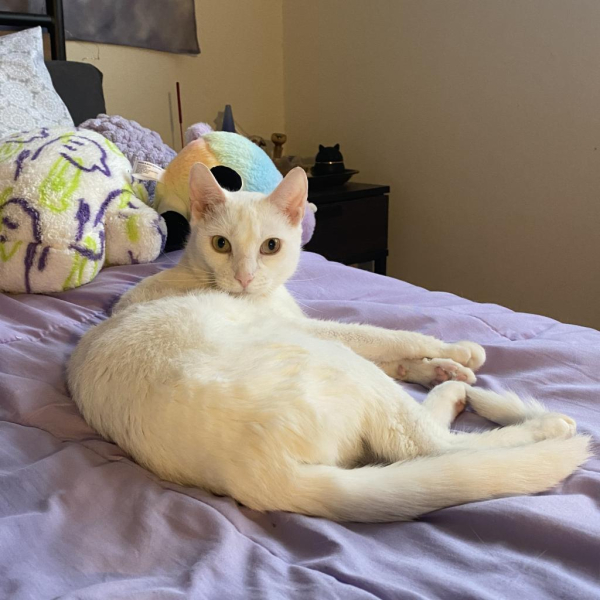
You are a GUI agent. You are given a task and a screenshot of the screen. Output one action in this format:
    pyautogui.click(x=<x>, y=<y>)
    Task: Click on the night stand
    Image resolution: width=600 pixels, height=600 pixels.
    Given the screenshot: What is the action you would take?
    pyautogui.click(x=335, y=221)